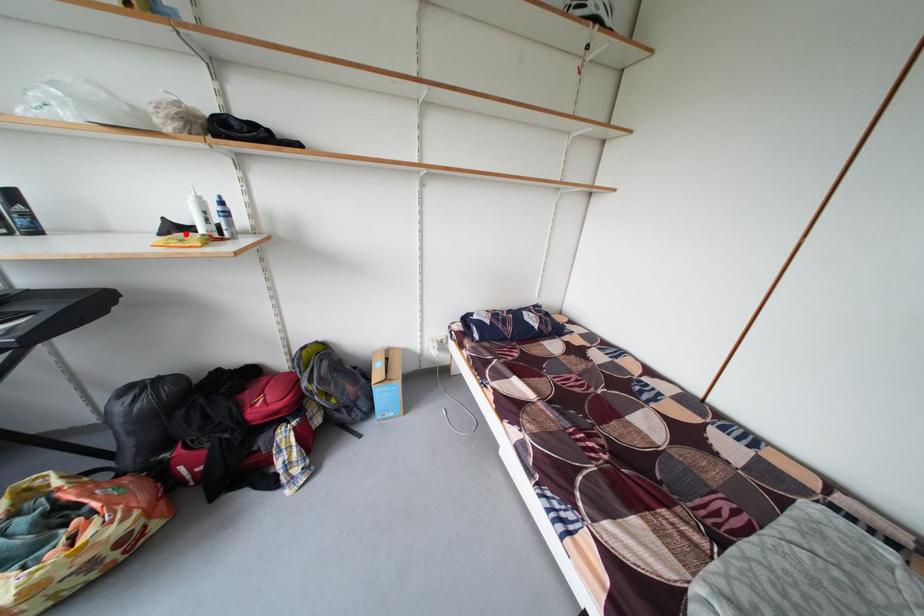
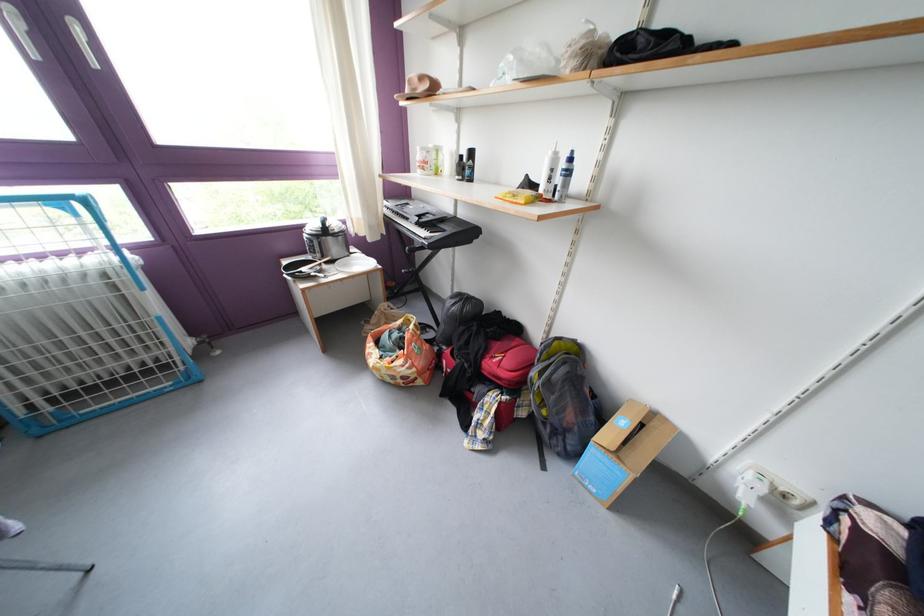
The point at the highlighted location is marked in the first image. Where is the corresponding point in the second image?

(540, 191)